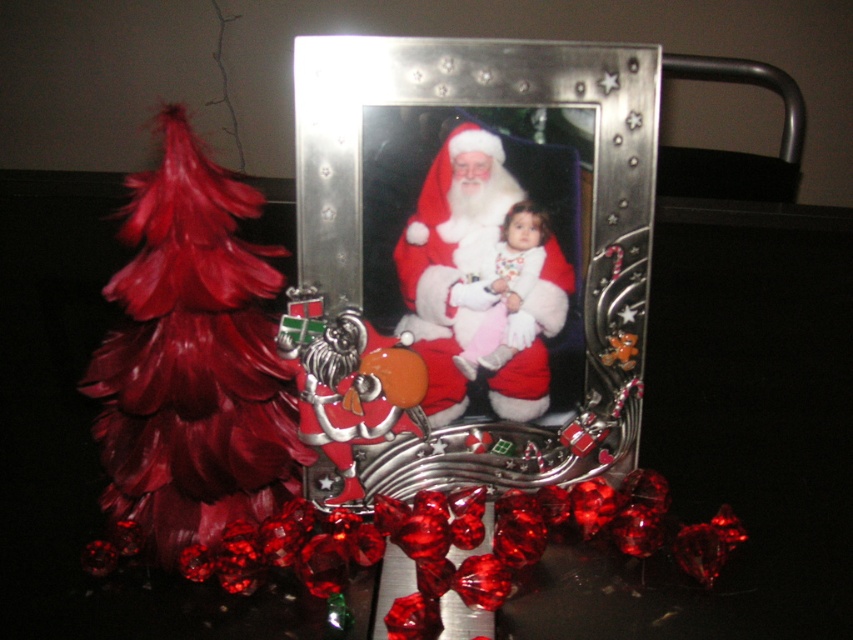
Between velvet santa at center and white fluffy baby at center, which one is positioned lower?

white fluffy baby at center is lower down.

Which is above, velvet santa at center or white fluffy baby at center?

velvet santa at center

Does point (485, 202) lie in front of point (492, 340)?

Yes, it is.

What are the coordinates of `velvet santa at center` in the screenshot? It's located at (477, 282).

Based on the photo, who is shorter, metallic silver picture frame at center or velvet santa at center?

With less height is velvet santa at center.

Does metallic silver picture frame at center have a greater height compared to velvet santa at center?

Indeed, metallic silver picture frame at center has a greater height compared to velvet santa at center.

Is point (549, 432) closer to viewer compared to point (503, 385)?

No, (549, 432) is behind (503, 385).

Find the location of a particular element. The height and width of the screenshot is (640, 853). metallic silver picture frame at center is located at coordinates [450, 216].

Does point (393, 108) come farther from viewer compared to point (479, 324)?

No, it is in front of (479, 324).

This screenshot has width=853, height=640. I want to click on metallic silver picture frame at center, so click(450, 216).

This screenshot has width=853, height=640. Find the location of `metallic silver picture frame at center`. metallic silver picture frame at center is located at coordinates (450, 216).